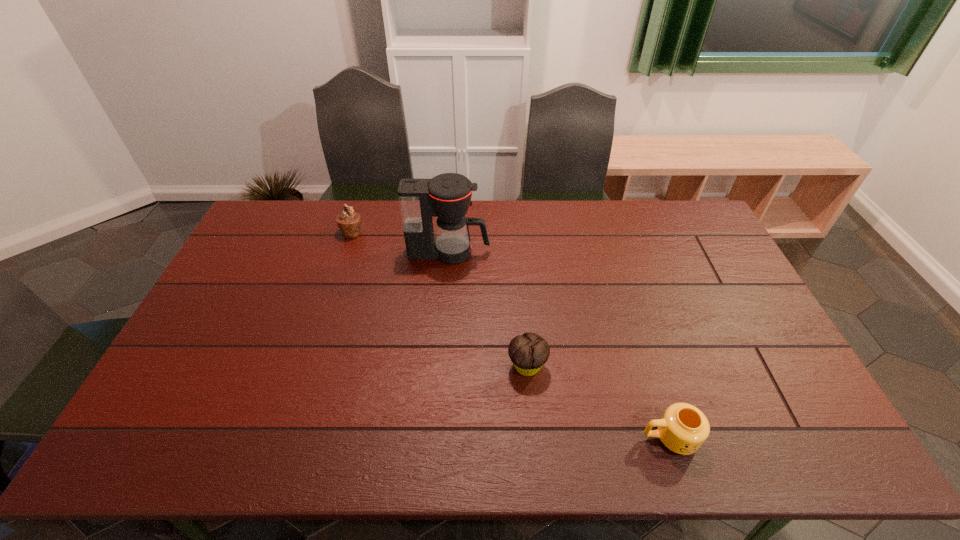
You are a GUI agent. You are given a task and a screenshot of the screen. Output one action in this format:
    pyautogui.click(x=<x>, y=<y>)
    Task: Click on the free space at the right edge of the desktop
    
    Given the screenshot: What is the action you would take?
    pyautogui.click(x=808, y=403)

Locate an element on the screen. The width and height of the screenshot is (960, 540). free space at the near left corner is located at coordinates (154, 431).

The image size is (960, 540). Find the location of `vacant space at the far right corner`. vacant space at the far right corner is located at coordinates (684, 202).

In order to click on free spot between the mug and the leftmost object in this screenshot , I will do `click(511, 335)`.

Find the location of `empty space that is in between the farther muffin and the third object from right to left`. empty space that is in between the farther muffin and the third object from right to left is located at coordinates (400, 242).

Locate an element on the screen. This screenshot has height=540, width=960. free area in between the third farthest object and the farther muffin is located at coordinates (440, 299).

I want to click on free space between the mug and the leftmost object, so tap(511, 335).

What are the coordinates of `blank region between the tallest object and the rightmost object` in the screenshot? It's located at (560, 345).

Locate an element on the screen. free spot between the mug and the left muffin is located at coordinates (511, 335).

Find the location of `free space that is in between the nearer muffin and the farther muffin`. free space that is in between the nearer muffin and the farther muffin is located at coordinates (440, 299).